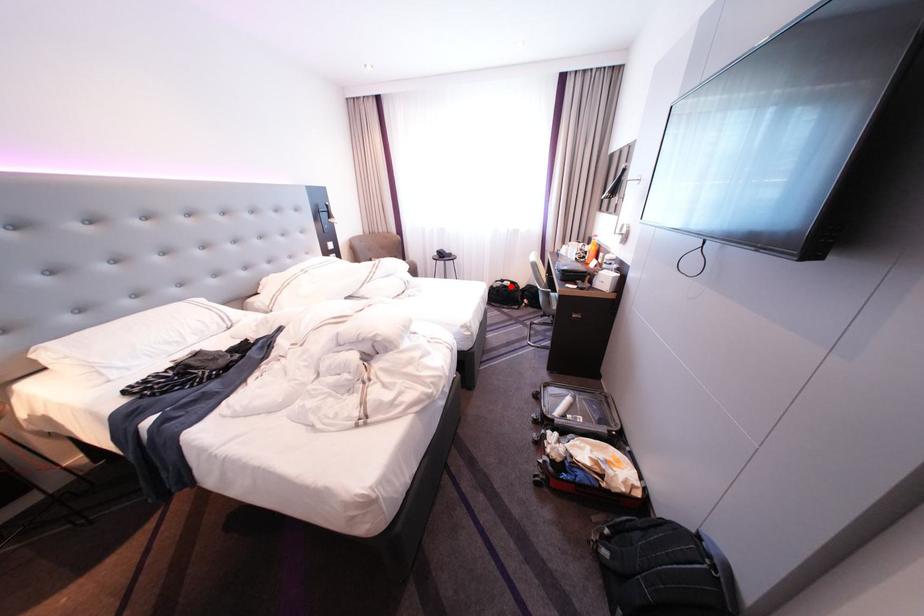
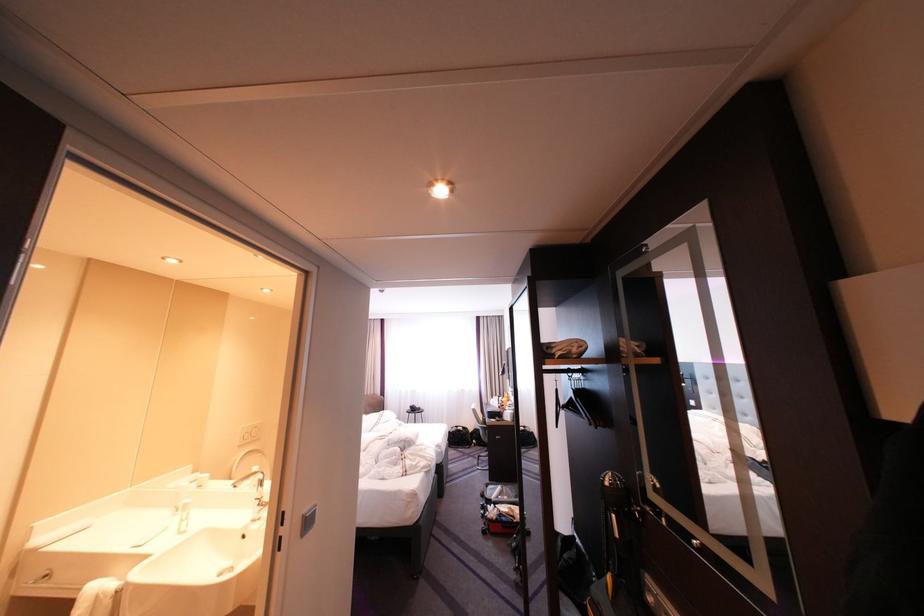
The point at the highlighted location is marked in the first image. Where is the corresponding point in the second image?

(467, 431)